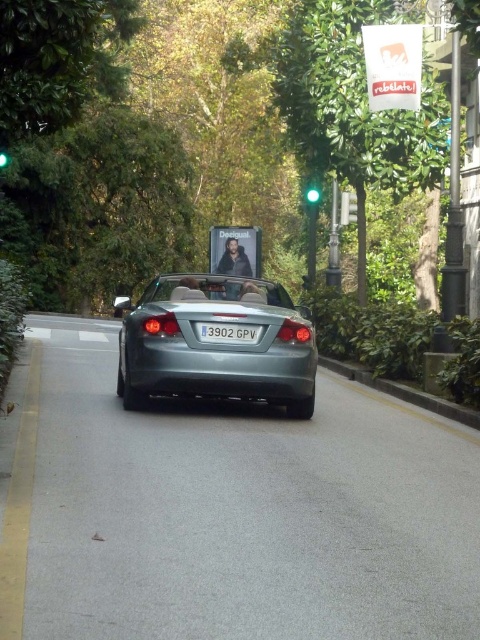
Question: Is satin silver convertible at center to the left of green glass traffic light at upper center from the viewer's perspective?

Choices:
 (A) yes
 (B) no

Answer: (A)

Question: Which object appears closest to the camera in this image?

Choices:
 (A) green glass traffic light at upper center
 (B) satin silver convertible at center
 (C) green glass traffic light at center

Answer: (B)

Question: Is satin silver convertible at center in front of white plastic license plate at center?

Choices:
 (A) yes
 (B) no

Answer: (A)

Question: Does satin silver convertible at center have a greater width compared to green glass traffic light at center?

Choices:
 (A) yes
 (B) no

Answer: (A)

Question: Among these points, which one is nearest to the camera?

Choices:
 (A) (344, 218)
 (B) (310, 200)
 (C) (159, 388)

Answer: (C)

Question: Which is farther from the green glass traffic light at upper center?

Choices:
 (A) white plastic license plate at center
 (B) satin silver convertible at center
 (C) green glass traffic light at center

Answer: (A)